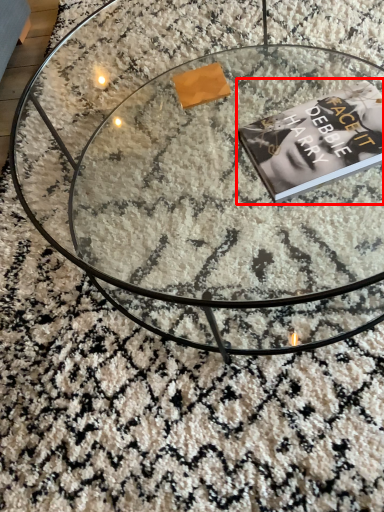
Question: From the image's perspective, where is paperback book (annotated by the red box) located in relation to coffee table in the image?

Choices:
 (A) above
 (B) below

Answer: (B)